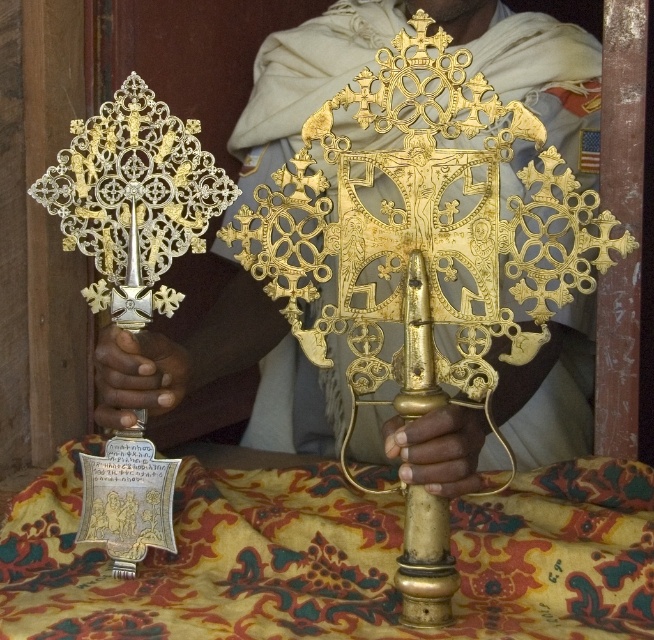
Based on the photo, who is taller, floral-patterned fabric at center or golden polished hand at center?

floral-patterned fabric at center is taller.

Is point (213, 490) behind point (156, 380)?

Yes, it is behind point (156, 380).

What do you see at coordinates (336, 557) in the screenshot?
I see `floral-patterned fabric at center` at bounding box center [336, 557].

Locate an element on the screen. This screenshot has height=640, width=654. floral-patterned fabric at center is located at coordinates (336, 557).

Can you confirm if floral-patterned fabric at center is thinner than gold metallic hand at center?

In fact, floral-patterned fabric at center might be wider than gold metallic hand at center.

Can you confirm if floral-patterned fabric at center is positioned to the right of gold metallic hand at center?

Incorrect, floral-patterned fabric at center is not on the right side of gold metallic hand at center.

Who is more distant from viewer, (294, 576) or (447, 442)?

The point (294, 576) is more distant.

You are a GUI agent. You are given a task and a screenshot of the screen. Output one action in this format:
    pyautogui.click(x=<x>, y=<y>)
    Task: Click on the floral-patterned fabric at center
    This screenshot has width=654, height=640.
    Given the screenshot: What is the action you would take?
    pyautogui.click(x=336, y=557)

Who is more distant from viewer, (377, 3) or (118, 412)?

Positioned behind is point (377, 3).

Does gold metallic cross at center appear under golden polished hand at center?

No, gold metallic cross at center is not below golden polished hand at center.

This screenshot has height=640, width=654. I want to click on gold metallic cross at center, so click(388, 44).

Locate an element on the screen. Image resolution: width=654 pixels, height=640 pixels. gold metallic cross at center is located at coordinates (388, 44).